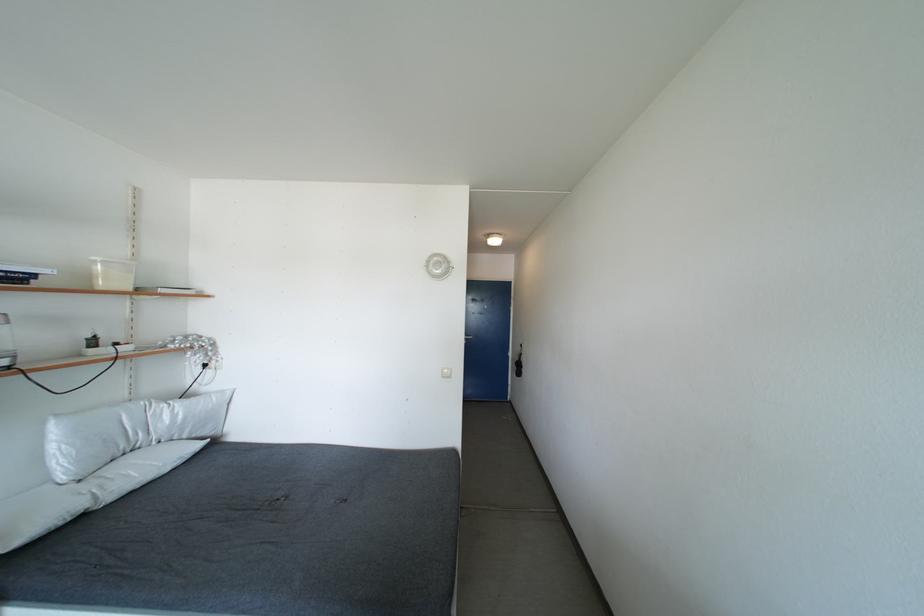
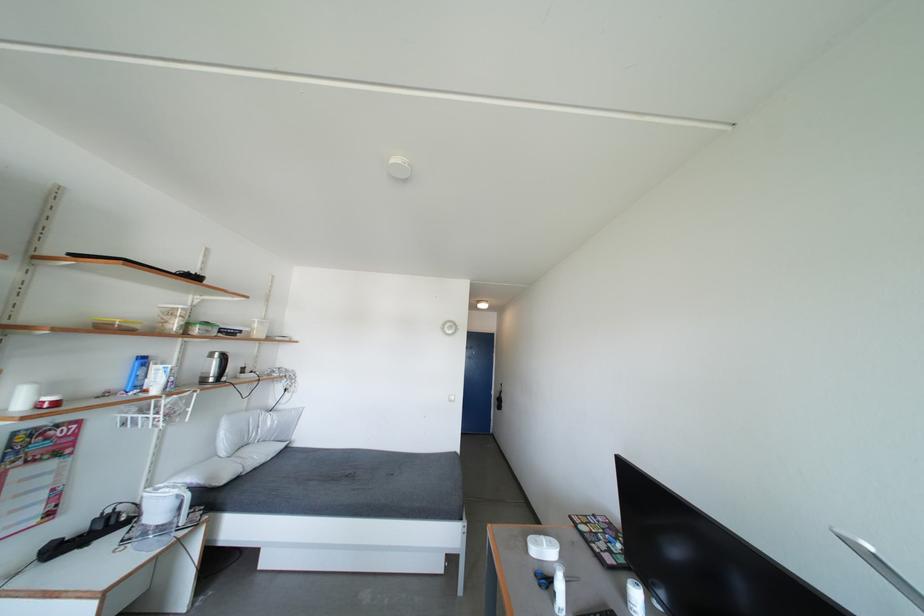
In the second image, find the point that corresponds to pixel 58 452 in the first image.

(228, 439)